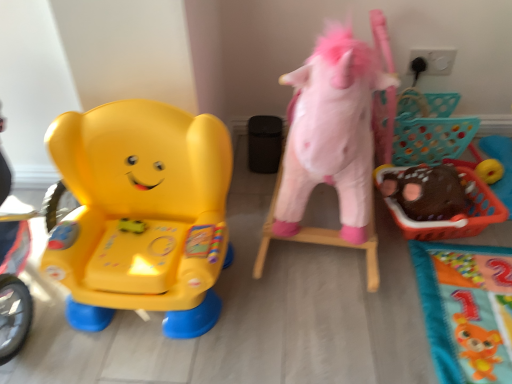
Question: Is matte plastic elephant at left, the first toy viewed from the left, to the left or to the right of fluffy pink unicorn at right, which is the 2th toy from left to right, in the image?

Choices:
 (A) left
 (B) right

Answer: (A)

Question: In the image, is matte plastic elephant at left, which appears as the third toy when viewed from the right, positioned in front of or behind fluffy pink unicorn at right, which is the 2th toy from left to right?

Choices:
 (A) behind
 (B) front

Answer: (A)

Question: Estimate the real-world distances between objects in this image. Which object is farther from the matte plastic elephant at left, the first toy viewed from the left?

Choices:
 (A) fluffy pink unicorn at right, which is the 2th toy from left to right
 (B) brown fuzzy plush at right, which appears as the 3th toy when viewed from the left

Answer: (B)

Question: Which is nearer to the brown fuzzy plush at right, which appears as the 3th toy when viewed from the left?

Choices:
 (A) matte plastic elephant at left, the first toy viewed from the left
 (B) fluffy pink unicorn at right, arranged as the 2th toy when viewed from the right

Answer: (B)